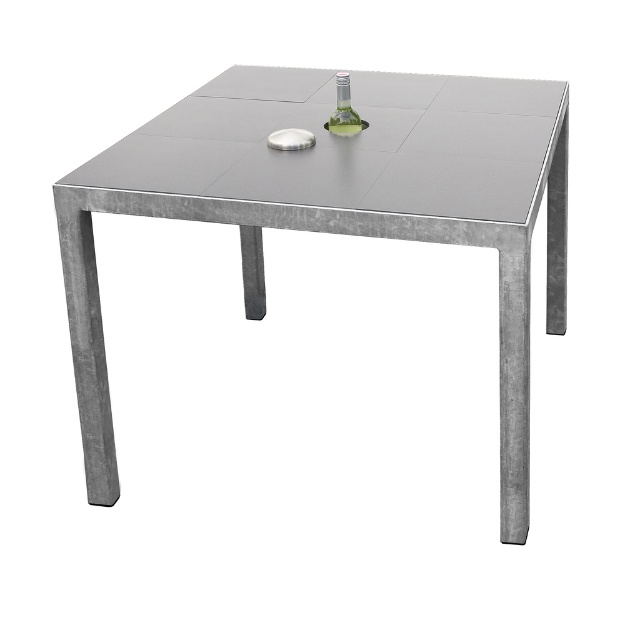
Question: Can you confirm if metallic gray table at center is positioned to the right of transparent glass bottle at center?

Choices:
 (A) no
 (B) yes

Answer: (B)

Question: Can you confirm if metallic gray table at center is smaller than transparent glass bottle at center?

Choices:
 (A) no
 (B) yes

Answer: (A)

Question: Which object is farther from the camera taking this photo?

Choices:
 (A) transparent glass bottle at center
 (B) metallic gray table at center

Answer: (A)

Question: Which of the following is the closest to the observer?

Choices:
 (A) metallic gray table at center
 (B) transparent glass bottle at center

Answer: (A)

Question: Does metallic gray table at center appear over transparent glass bottle at center?

Choices:
 (A) yes
 (B) no

Answer: (B)